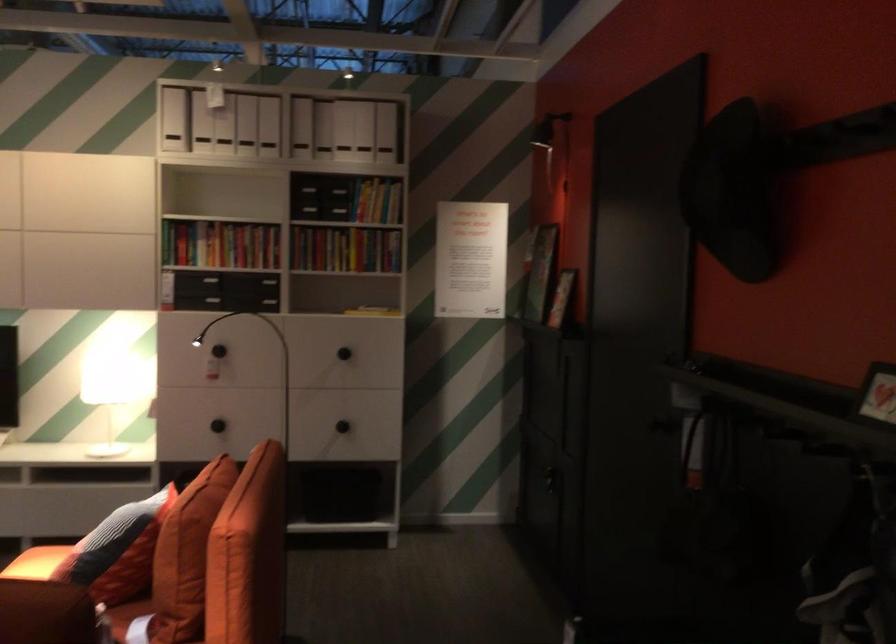
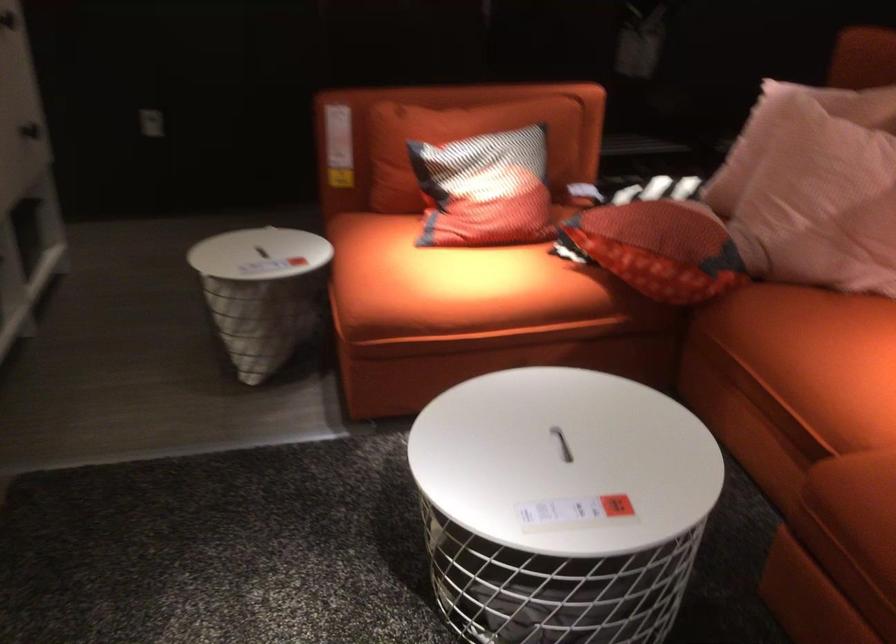
The point at (83, 543) is marked in the first image. Where is the corresponding point in the second image?

(485, 190)